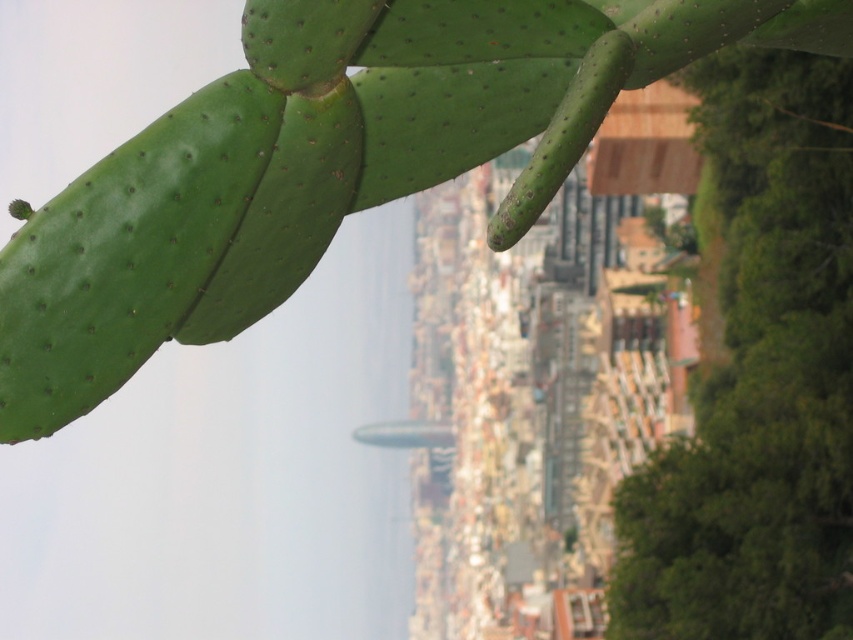
Does green spiny cactus at upper left come behind green leafy tree at right?

No, green spiny cactus at upper left is closer to the viewer.

Is green spiny cactus at upper left thinner than green leafy tree at right?

Correct, green spiny cactus at upper left's width is less than green leafy tree at right's.

Between point (442, 10) and point (833, 321), which one is positioned in front?

Point (442, 10) is in front.

Image resolution: width=853 pixels, height=640 pixels. Find the location of `green spiny cactus at upper left`. green spiny cactus at upper left is located at coordinates (328, 163).